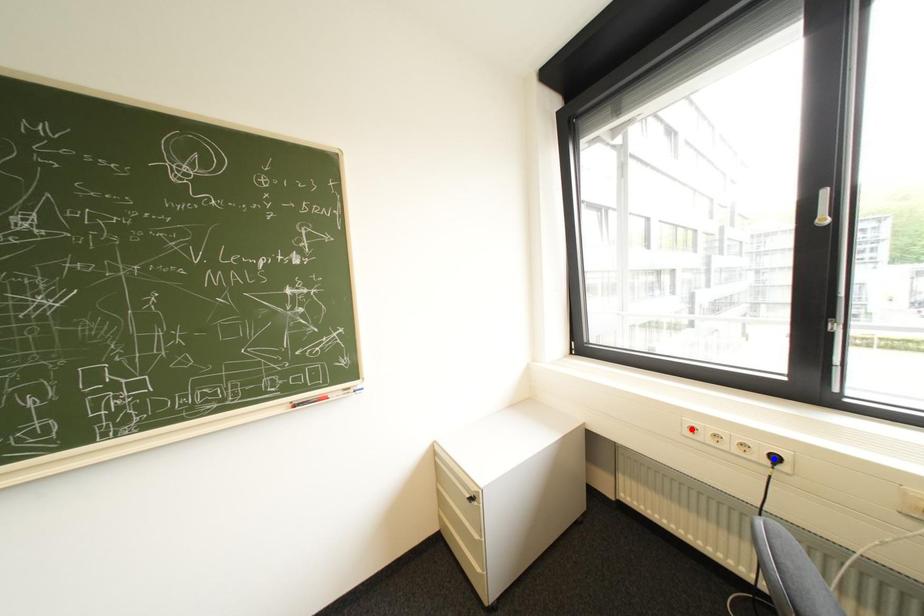
Question: Which of the two points in the image is closer to the camera?

Choices:
 (A) Blue point is closer.
 (B) Red point is closer.

Answer: (A)